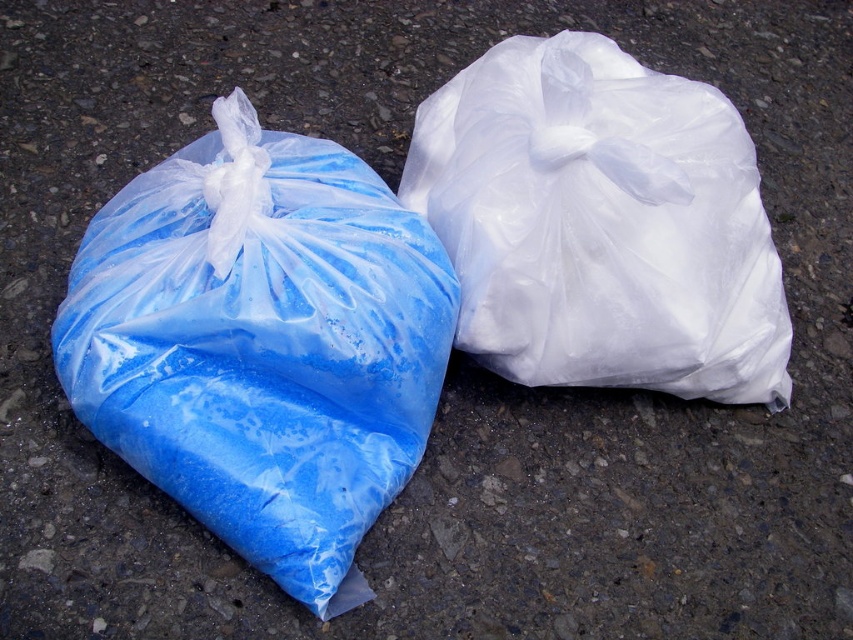
Does blue translucent bag at left appear on the left side of white translucent bag at right?

Indeed, blue translucent bag at left is positioned on the left side of white translucent bag at right.

Does blue translucent bag at left appear under white translucent bag at right?

Yes.

Find the location of a particular element. blue translucent bag at left is located at coordinates (262, 344).

Find the location of a particular element. The height and width of the screenshot is (640, 853). blue translucent bag at left is located at coordinates (262, 344).